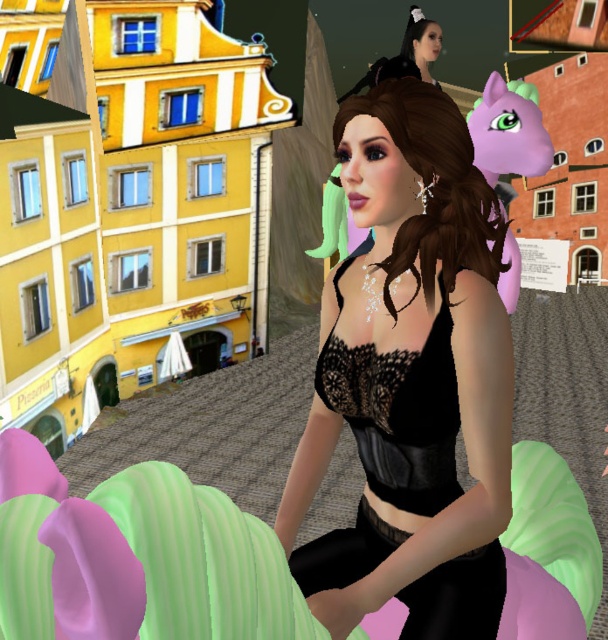
Between green rubber balloon at lower center and black lace dress at center, which one is positioned lower?

Positioned lower is green rubber balloon at lower center.

Does point (593, 566) come closer to viewer compared to point (326, 554)?

No, it is behind (326, 554).

Between point (271, 621) and point (395, 413), which one is positioned in front?

Point (271, 621)

You are a GUI agent. You are given a task and a screenshot of the screen. Output one action in this format:
    pyautogui.click(x=<x>, y=<y>)
    Task: Click on the green rubber balloon at lower center
    
    Given the screenshot: What is the action you would take?
    pyautogui.click(x=134, y=557)